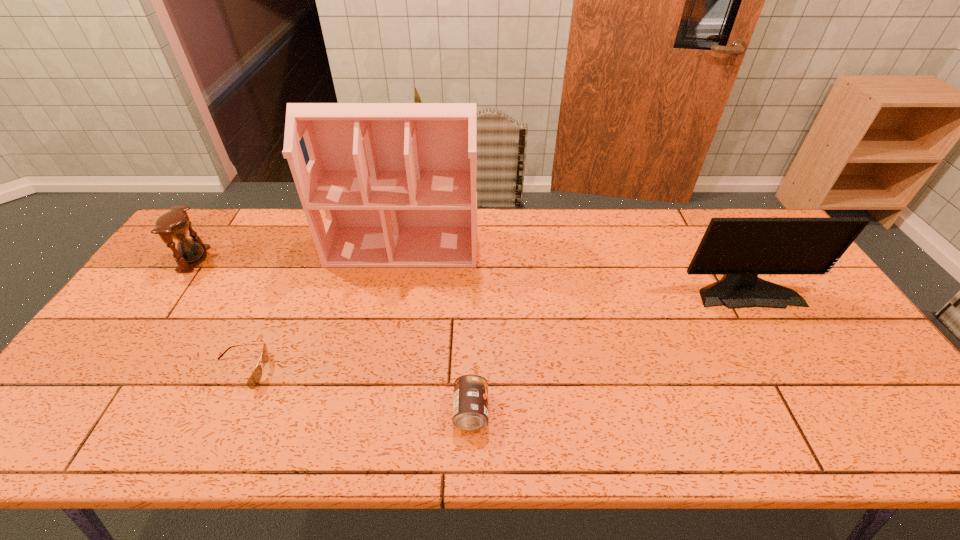
Identify the location of free area in between the rightmost object and the can. The image size is (960, 540). (608, 349).

Find the location of a particular element. The image size is (960, 540). free space that is in between the leftmost object and the fourth shortest object is located at coordinates (469, 273).

Select which object appears as the closest to the monitor. Please provide its 2D coordinates. Your answer should be formatted as a tuple, i.e. [(x, y)], where the tuple contains the x and y coordinates of a point satisfying the conditions above.

[(397, 181)]

This screenshot has height=540, width=960. What are the coordinates of `object that is the third closest one to the hourglass` in the screenshot? It's located at (470, 405).

Where is `vacant region that satisfies the following two spatial constraints: 1. on the screen side of the monitor; 2. on the front label of the can`? vacant region that satisfies the following two spatial constraints: 1. on the screen side of the monitor; 2. on the front label of the can is located at coordinates (820, 411).